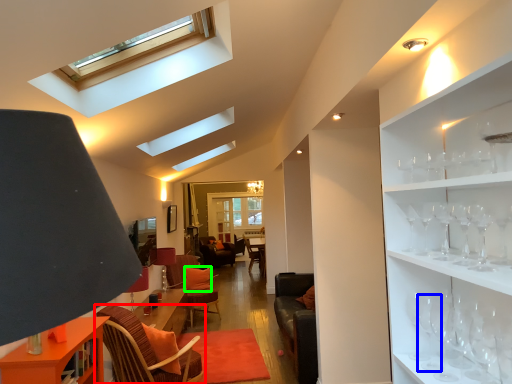
Question: Which object is positioned closest to chair (highlighted by a red box)? Select from wine glass (highlighted by a blue box) and pillow (highlighted by a green box).

Choices:
 (A) wine glass
 (B) pillow

Answer: (A)